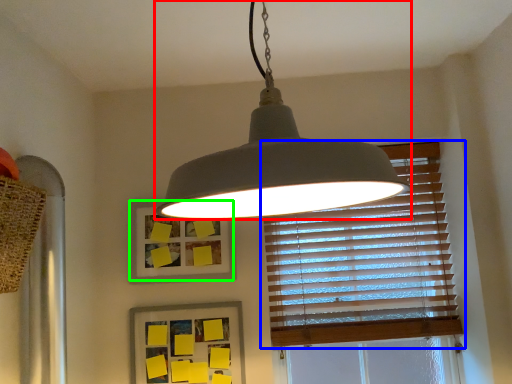
Question: Which object is the closest to the lamp (highlighted by a red box)? Choose among these: window blind (highlighted by a blue box) or picture frame (highlighted by a green box).

Choices:
 (A) window blind
 (B) picture frame

Answer: (B)